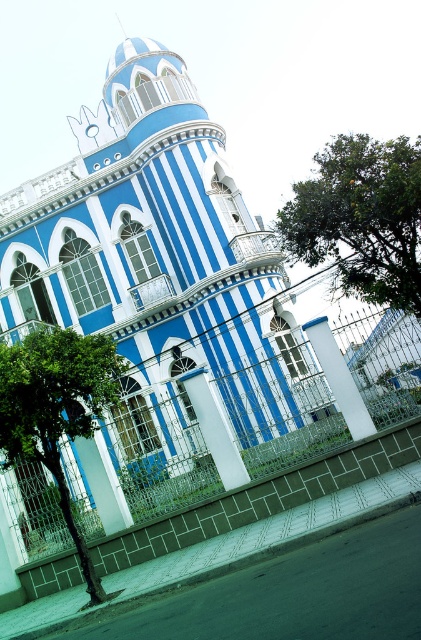
Question: Which object is the closest to the metallic wire fence at center?

Choices:
 (A) green leafy tree at lower left
 (B) green leafy tree at upper right

Answer: (A)

Question: Which of the following is the farthest from the observer?

Choices:
 (A) blue glossy building at center
 (B) green leafy tree at upper right

Answer: (B)

Question: Can you confirm if metallic wire fence at center is positioned below green leafy tree at lower left?

Choices:
 (A) no
 (B) yes

Answer: (A)

Question: Can you confirm if blue glossy building at center is positioned below green leafy tree at lower left?

Choices:
 (A) yes
 (B) no

Answer: (B)

Question: Can you confirm if blue glossy building at center is positioned below green leafy tree at lower left?

Choices:
 (A) no
 (B) yes

Answer: (A)

Question: Which of the following is the closest to the observer?

Choices:
 (A) metallic wire fence at center
 (B) green leafy tree at upper right

Answer: (A)